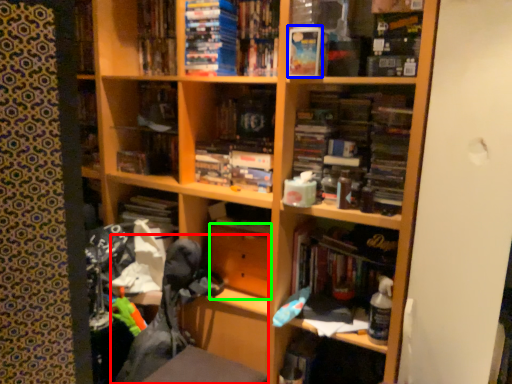
Question: Which is farther away from swivel chair (highlighted by a red box)? paperback book (highlighted by a blue box) or drawer (highlighted by a green box)?

Choices:
 (A) paperback book
 (B) drawer

Answer: (A)